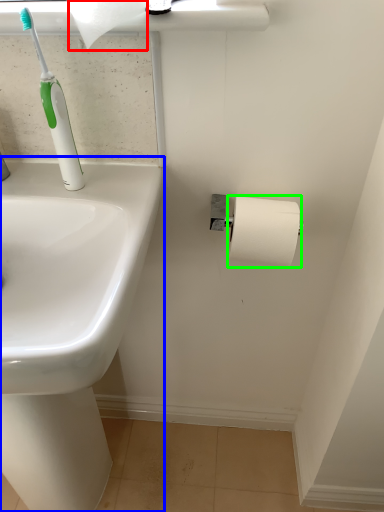
Question: Which is nearer to the toilet paper (highlighted by a red box)? sink (highlighted by a blue box) or toilet paper (highlighted by a green box).

Choices:
 (A) sink
 (B) toilet paper

Answer: (B)